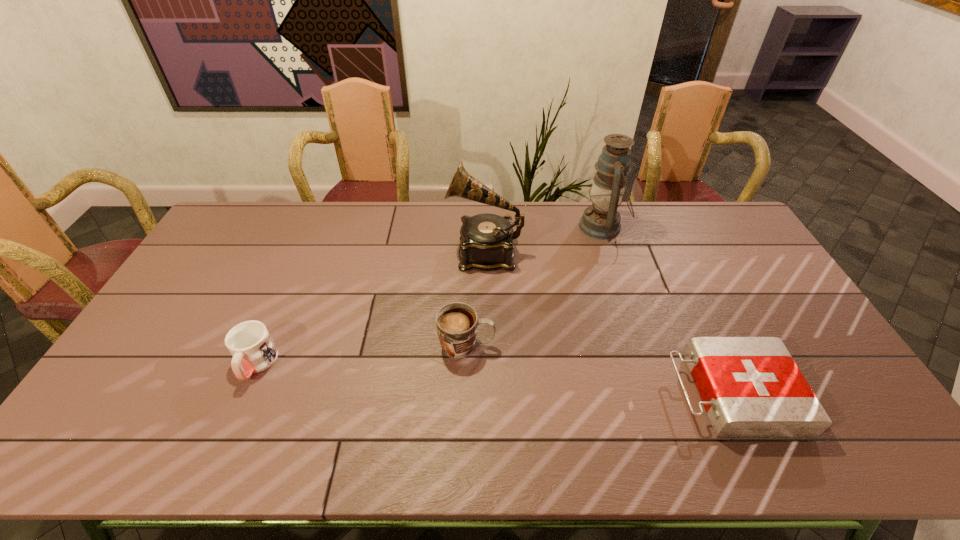
The width and height of the screenshot is (960, 540). I want to click on vacant space that is in between the shortest object and the phonograph record, so click(609, 323).

Where is `blank region between the oil lamp and the first-aid kit`? Image resolution: width=960 pixels, height=540 pixels. blank region between the oil lamp and the first-aid kit is located at coordinates (667, 310).

Find the location of `free area in between the oil lamp and the third tallest object`. free area in between the oil lamp and the third tallest object is located at coordinates (535, 286).

Image resolution: width=960 pixels, height=540 pixels. Find the location of `free space that is in between the right mug and the oil lamp`. free space that is in between the right mug and the oil lamp is located at coordinates (535, 286).

At what (x,y) coordinates should I click in order to perform the action: click on free space between the first-aid kit and the phonograph record. Please return your answer as a coordinate pair (x, y). Looking at the image, I should click on (609, 323).

Locate an element on the screen. This screenshot has height=540, width=960. the second closest object to the oil lamp is located at coordinates (751, 388).

Choose which object is the second nearest neighbor to the first-aid kit. Please provide its 2D coordinates. Your answer should be formatted as a tuple, i.e. [(x, y)], where the tuple contains the x and y coordinates of a point satisfying the conditions above.

[(601, 220)]

The image size is (960, 540). Identify the location of free space that satisfies the following two spatial constraints: 1. on the horn of the phonograph record; 2. on the side of the left mug with the handle. (486, 364).